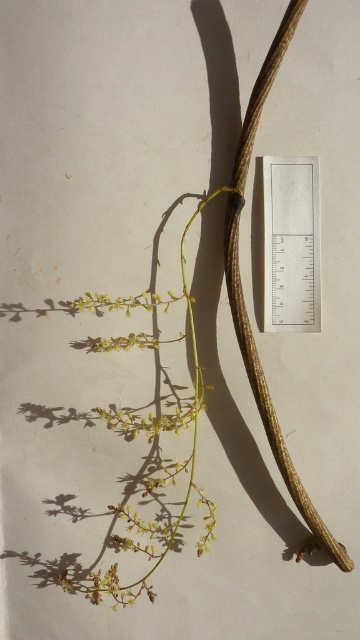
You are an artist trying to draw the plant shown in the image. You need to decide which object to use as a reference for size comparison. Which object is narrower between the white paper ruler at upper center and the brown rough branch at center?

The white paper ruler at upper center is thinner than the brown rough branch at center, so the white paper ruler at upper center is narrower.

You are an artist preparing to draw this plant. You notice the white paper ruler at upper center and the brown rough branch at center. Which object takes up more space in the image?

The brown rough branch at center takes up more space in the image than the white paper ruler at upper center because the white paper ruler at upper center occupies less space than brown rough branch at center.

In the scene shown: You are an artist sketching the plant and need to ensure accuracy. The brown rough branch at center has a shadow that falls in a specific direction. Based on the position of the white paper ruler at upper center relative to the branch, can you determine which side of the branch the shadow is cast towards?

The white paper ruler at upper center is to the right of the brown rough branch at center, so the shadow of the brown rough branch at center would be cast towards the left side of the branch.